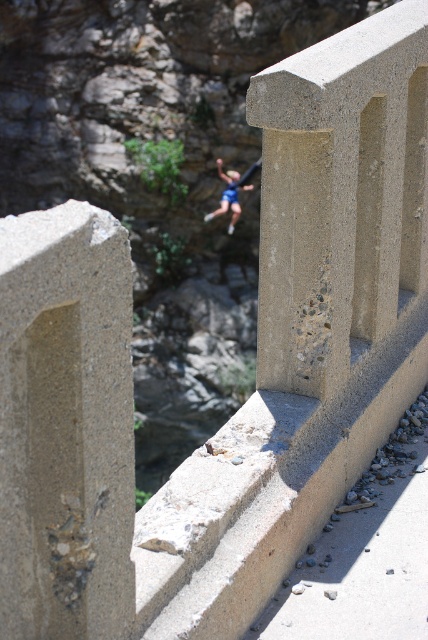
Question: Which is farther from the blue fabric rock climber at center?

Choices:
 (A) beige concrete pillar at center
 (B) gray textured concrete at left

Answer: (B)

Question: Which object appears closest to the camera in this image?

Choices:
 (A) blue fabric rock climber at center
 (B) gray textured concrete at left

Answer: (B)

Question: Which point is farther to the camera?

Choices:
 (A) gray textured concrete at left
 (B) blue fabric rock climber at center

Answer: (B)

Question: Considering the relative positions of beige concrete pillar at center and blue fabric rock climber at center in the image provided, where is beige concrete pillar at center located with respect to blue fabric rock climber at center?

Choices:
 (A) right
 (B) left

Answer: (A)

Question: Does beige concrete pillar at center have a smaller size compared to blue fabric rock climber at center?

Choices:
 (A) no
 (B) yes

Answer: (A)

Question: Is gray textured concrete at left further to camera compared to beige concrete pillar at center?

Choices:
 (A) no
 (B) yes

Answer: (A)